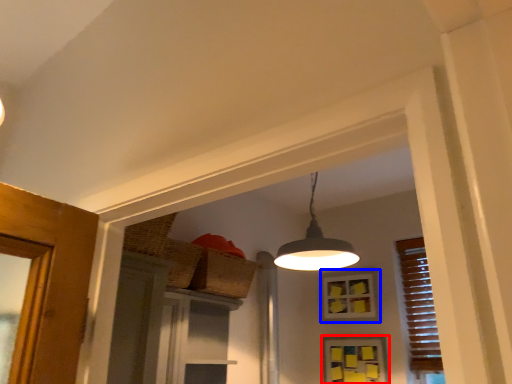
Question: Which point is further to the camera, window (highlighted by a red box) or window (highlighted by a blue box)?

Choices:
 (A) window
 (B) window

Answer: (B)